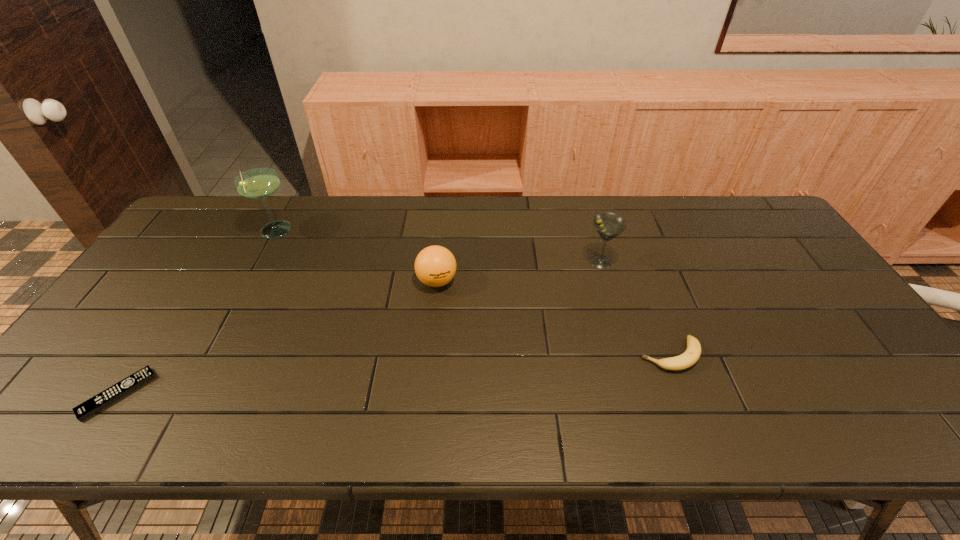
Find the location of a particular element. The height and width of the screenshot is (540, 960). the taller martini is located at coordinates (259, 183).

The height and width of the screenshot is (540, 960). Identify the location of the left martini. (259, 183).

Where is `the right martini`? The height and width of the screenshot is (540, 960). the right martini is located at coordinates (608, 225).

The width and height of the screenshot is (960, 540). What are the coordinates of `the second tallest object` in the screenshot? It's located at (608, 225).

Find the location of `the third tallest object`. the third tallest object is located at coordinates pos(435,266).

Identify the location of the third object from left to right. (435, 266).

I want to click on banana, so click(x=691, y=355).

Find the location of a particular element. the leftmost object is located at coordinates (98, 402).

Locate an element on the screen. Image resolution: width=960 pixels, height=540 pixels. remote control is located at coordinates (98, 402).

Image resolution: width=960 pixels, height=540 pixels. Identify the location of free space located on the right of the farther martini. (382, 231).